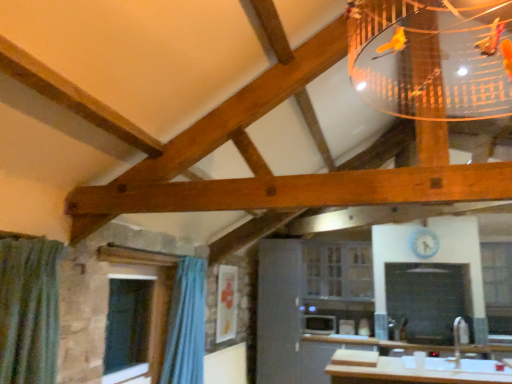
What do you see at coordinates (338, 270) in the screenshot? I see `clear glass cabinet at center, which appears as the 2th window when viewed from the left` at bounding box center [338, 270].

Describe the element at coordinates (498, 285) in the screenshot. This screenshot has height=384, width=512. I see `clear glass window at center, acting as the 2th window starting from the front` at that location.

Identify the location of clear glass cabinet at center, which appears as the 2th window when viewed from the left. The width and height of the screenshot is (512, 384). (338, 270).

Where is `shower curtain below the clear glass window at center, which is the first window in right-to-left order (from the image's perspective)`? This screenshot has width=512, height=384. shower curtain below the clear glass window at center, which is the first window in right-to-left order (from the image's perspective) is located at coordinates (186, 325).

From the image's perspective, is clear glass window at center, the 2th window when ordered from back to front, located above blue fabric curtain at lower left?

Indeed, from the image's perspective, clear glass window at center, the 2th window when ordered from back to front, is shown above blue fabric curtain at lower left.

Would you say blue fabric curtain at lower left is part of clear glass window at center, the third window when ordered from left to right,'s contents?

That's incorrect, blue fabric curtain at lower left is not inside clear glass window at center, the third window when ordered from left to right.

Does clear glass window at center, acting as the 2th window starting from the front, have a smaller size compared to blue fabric curtain at lower left?

Indeed, clear glass window at center, acting as the 2th window starting from the front, has a smaller size compared to blue fabric curtain at lower left.

Is clear glass cabinet at center, which appears as the 1th window when viewed from the back, in contact with blue fabric curtain at lower left?

No, clear glass cabinet at center, which appears as the 1th window when viewed from the back, is not beside blue fabric curtain at lower left.

Between clear glass cabinet at center, which appears as the 2th window when viewed from the left, and blue fabric curtain at lower left, which one is positioned behind?

clear glass cabinet at center, which appears as the 2th window when viewed from the left, is further from the camera.

Choose the correct answer: Is clear glass cabinet at center, which appears as the 2th window when viewed from the left, inside blue fabric curtain at lower left or outside it?

clear glass cabinet at center, which appears as the 2th window when viewed from the left, exists outside the volume of blue fabric curtain at lower left.

Is blue fabric curtain at lower left at the back of clear glass cabinet at center, which appears as the 2th window when viewed from the left?

No.

What's the angular difference between clear glass window at lower left, the third window viewed from the back, and clear glass cabinet at center, which appears as the 2th window when viewed from the left,'s facing directions?

There is a 90.6-degree angle between the facing directions of clear glass window at lower left, the third window viewed from the back, and clear glass cabinet at center, which appears as the 2th window when viewed from the left.

From the image's perspective, between clear glass window at lower left, which is the first window from left to right, and clear glass cabinet at center, which appears as the 2th window when viewed from the left, who is located below?

clear glass window at lower left, which is the first window from left to right.

From their relative heights in the image, would you say clear glass window at lower left, which ranks as the first window in front-to-back order, is taller or shorter than clear glass cabinet at center, which appears as the 1th window when viewed from the back?

In the image, clear glass window at lower left, which ranks as the first window in front-to-back order, appears to be taller than clear glass cabinet at center, which appears as the 1th window when viewed from the back.

Is white glossy microwave at center looking in the opposite direction of clear glass cabinet at center, acting as the 2th window starting from the right?

No, white glossy microwave at center is not facing the opposite direction of clear glass cabinet at center, acting as the 2th window starting from the right.

Is there a large distance between white glossy microwave at center and clear glass cabinet at center, acting as the 2th window starting from the right?

That's not correct — white glossy microwave at center is a little close to clear glass cabinet at center, acting as the 2th window starting from the right.

Considering the relative positions of white glossy microwave at center and clear glass cabinet at center, which is the 3th window in front-to-back order, in the image provided, is white glossy microwave at center to the left or to the right of clear glass cabinet at center, which is the 3th window in front-to-back order,?

Clearly, white glossy microwave at center is on the left of clear glass cabinet at center, which is the 3th window in front-to-back order, in the image.

From the image's perspective, who appears lower, clear glass window at lower left, the third window viewed from the back, or blue fabric curtain at lower left?

blue fabric curtain at lower left.

Do you think clear glass window at lower left, which is the first window from left to right, is within blue fabric curtain at lower left, or outside of it?

clear glass window at lower left, which is the first window from left to right, is not enclosed by blue fabric curtain at lower left.

Where is `window below the blue fabric curtain at lower left (from a real-world perspective)`? The width and height of the screenshot is (512, 384). window below the blue fabric curtain at lower left (from a real-world perspective) is located at coordinates (153, 308).

From their relative heights in the image, would you say clear glass window at lower left, the third window viewed from the back, is taller or shorter than blue fabric curtain at lower left?

clear glass window at lower left, the third window viewed from the back, is shorter than blue fabric curtain at lower left.

Between clear glass cabinet at center, which appears as the 2th window when viewed from the left, and white glossy microwave at center, which one has larger size?

clear glass cabinet at center, which appears as the 2th window when viewed from the left.

From a real-world perspective, which is physically below, clear glass cabinet at center, acting as the 2th window starting from the right, or white glossy microwave at center?

white glossy microwave at center.

From the image's perspective, is clear glass cabinet at center, which appears as the 2th window when viewed from the left, on top of white glossy microwave at center?

Yes, from the image's perspective, clear glass cabinet at center, which appears as the 2th window when viewed from the left, is over white glossy microwave at center.

Can you tell me how much clear glass cabinet at center, acting as the 2th window starting from the right, and white glossy microwave at center differ in facing direction?

The facing directions of clear glass cabinet at center, acting as the 2th window starting from the right, and white glossy microwave at center are 1.36 degrees apart.

Is white glossy microwave at center closer to camera compared to blue fabric curtain at lower left?

No, the depth of white glossy microwave at center is greater than that of blue fabric curtain at lower left.

From the image's perspective, who appears lower, white glossy microwave at center or blue fabric curtain at lower left?

white glossy microwave at center, from the image's perspective.

From a real-world perspective, is white glossy microwave at center located beneath blue fabric curtain at lower left?

Correct, in the physical world, white glossy microwave at center is lower than blue fabric curtain at lower left.

There is a blue fabric curtain at lower left. Identify the location of the 3rd window above it (from the image's perspective). (498, 285).

You are a GUI agent. You are given a task and a screenshot of the screen. Output one action in this format:
    pyautogui.click(x=<x>, y=<y>)
    Task: Click on the 1st window positioned above the blue fabric curtain at lower left (from a real-world perspective)
    The width and height of the screenshot is (512, 384).
    Given the screenshot: What is the action you would take?
    pyautogui.click(x=338, y=270)

Which object lies nearer to the anchor point clear glass window at center, which is the first window in right-to-left order, blue fabric curtain at lower left or clear glass window at lower left, which is the first window from left to right?

blue fabric curtain at lower left.

Based on their spatial positions, is blue fabric curtain at lower left or clear glass cabinet at center, which appears as the 1th window when viewed from the back, further from clear glass window at lower left, which ranks as the first window in front-to-back order?

Among the two, clear glass cabinet at center, which appears as the 1th window when viewed from the back, is located further to clear glass window at lower left, which ranks as the first window in front-to-back order.

Considering their positions, is clear glass cabinet at center, which appears as the 2th window when viewed from the left, positioned closer to clear glass window at center, which is the first window in right-to-left order, than clear glass window at lower left, the third window viewed from the back?

Among the two, clear glass cabinet at center, which appears as the 2th window when viewed from the left, is located nearer to clear glass window at center, which is the first window in right-to-left order.

Based on their spatial positions, is white glossy microwave at center or clear glass window at center, the 2th window when ordered from back to front, closer to blue fabric curtain at lower left?

Based on the image, white glossy microwave at center appears to be nearer to blue fabric curtain at lower left.

Estimate the real-world distances between objects in this image. Which object is closer to blue fabric curtain at lower left, clear glass window at lower left, the 3th window in the right-to-left sequence, or clear glass window at center, the 2th window when ordered from back to front?

clear glass window at lower left, the 3th window in the right-to-left sequence.

Considering their positions, is clear glass cabinet at center, which is the 3th window in front-to-back order, positioned closer to clear glass window at center, which is the first window in right-to-left order, than blue fabric curtain at lower left?

Based on the image, clear glass cabinet at center, which is the 3th window in front-to-back order, appears to be nearer to clear glass window at center, which is the first window in right-to-left order.

In the scene shown: From the image, which object appears to be farther from clear glass window at lower left, which ranks as the first window in front-to-back order, blue fabric curtain at lower left or white glossy microwave at center?

white glossy microwave at center.

Based on the photo, based on their spatial positions, is clear glass window at lower left, the third window viewed from the back, or white glossy microwave at center closer to clear glass window at center, which is the first window in right-to-left order?

white glossy microwave at center is positioned closer to the anchor clear glass window at center, which is the first window in right-to-left order.

Where is `window situated between blue fabric curtain at lower left and clear glass window at center, the 2th window when ordered from back to front, from left to right`? This screenshot has width=512, height=384. window situated between blue fabric curtain at lower left and clear glass window at center, the 2th window when ordered from back to front, from left to right is located at coordinates (338, 270).

Locate an element on the screen. appliance situated between blue fabric curtain at lower left and clear glass window at center, acting as the 2th window starting from the front, from left to right is located at coordinates (320, 324).

Identify the location of shower curtain between clear glass window at lower left, the 3th window in the right-to-left sequence, and clear glass cabinet at center, which appears as the 2th window when viewed from the left, from front to back. (186, 325).

Where is `window between clear glass window at lower left, the third window viewed from the back, and clear glass window at center, the third window when ordered from left to right, in the horizontal direction`? window between clear glass window at lower left, the third window viewed from the back, and clear glass window at center, the third window when ordered from left to right, in the horizontal direction is located at coordinates (338, 270).